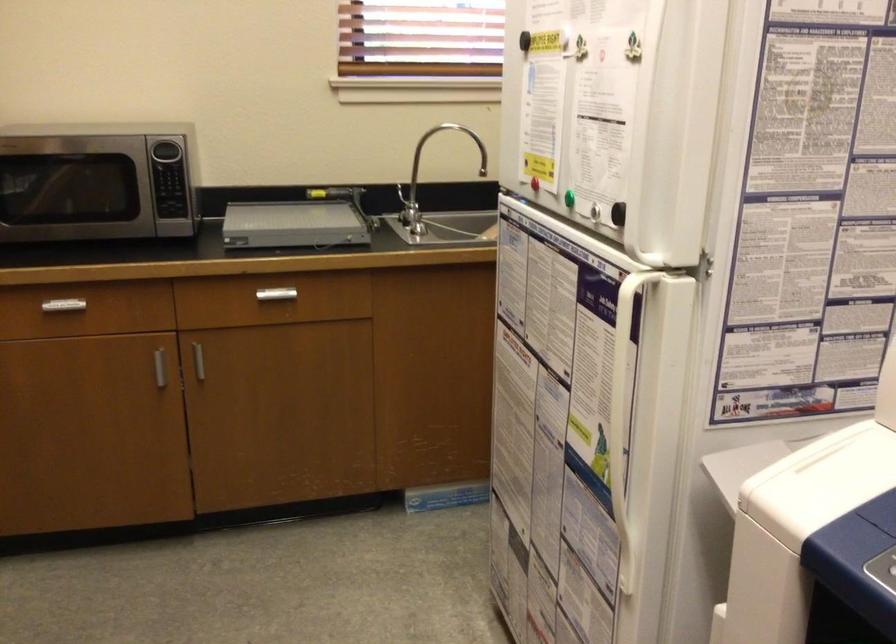
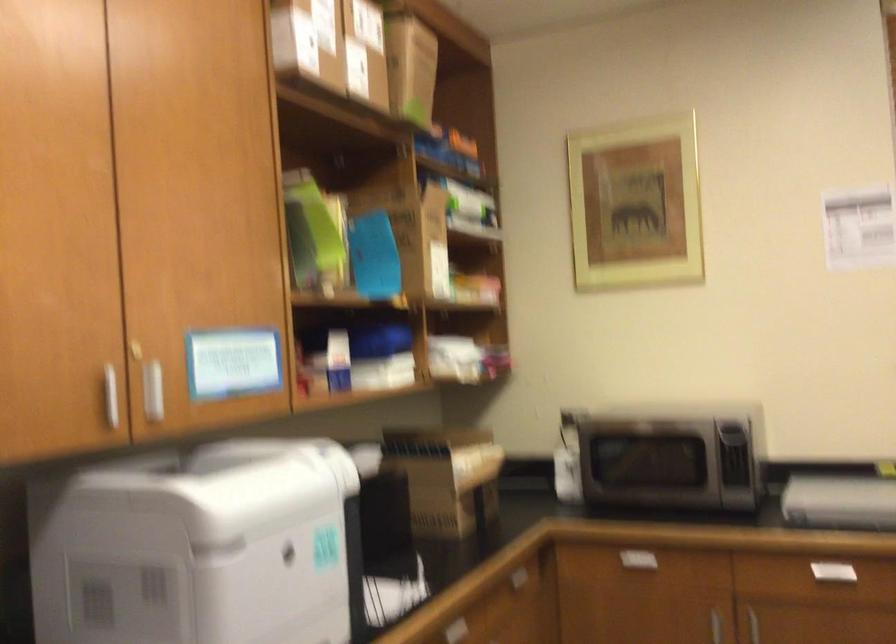
Question: I am providing you with two images of the same scene from different viewpoints. Which of the following objects are not visible in image2?

Choices:
 (A) white cabinet handle
 (B) white drawer handle
 (C) cardboard box
 (D) none of these

Answer: (D)